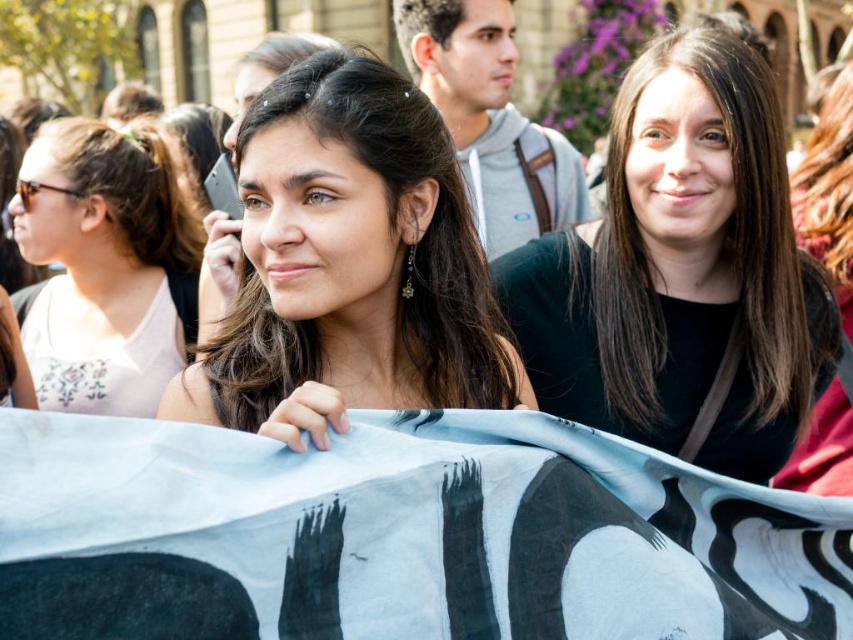
Measure the distance between black matte shirt at center and camera.

black matte shirt at center is 45.56 meters from camera.

Between black matte shirt at center and matte black phone at center, which one is positioned higher?

Positioned higher is black matte shirt at center.

Is point (543, 364) less distant than point (392, 314)?

No, it is not.

At what (x,y) coordinates should I click in order to perform the action: click on black matte shirt at center. Please return your answer as a coordinate pair (x, y). The width and height of the screenshot is (853, 640). Looking at the image, I should click on (682, 273).

What do you see at coordinates (682, 273) in the screenshot?
I see `black matte shirt at center` at bounding box center [682, 273].

Find the location of a particular element. The height and width of the screenshot is (640, 853). black matte shirt at center is located at coordinates (682, 273).

Where is `black matte shirt at center`? Image resolution: width=853 pixels, height=640 pixels. black matte shirt at center is located at coordinates (682, 273).

Is matte black phone at center thinner than white fabric at left?

In fact, matte black phone at center might be wider than white fabric at left.

Which of these two, matte black phone at center or white fabric at left, stands shorter?

matte black phone at center

Which is behind, point (241, 150) or point (68, 136)?

The point (68, 136) is more distant.

Locate an element on the screen. The width and height of the screenshot is (853, 640). matte black phone at center is located at coordinates (349, 266).